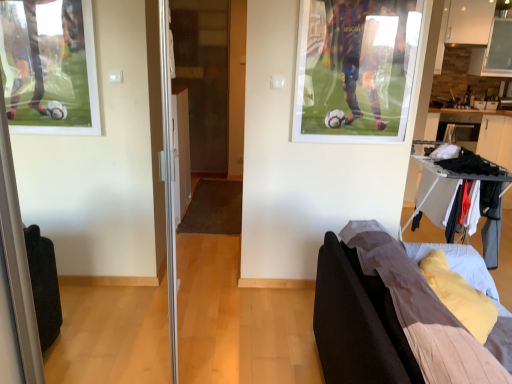
Question: From the image's perspective, is transparent glass screen door at center above or below brown fabric couch at lower right?

Choices:
 (A) above
 (B) below

Answer: (A)

Question: Considering the relative positions of transparent glass screen door at center and brown fabric couch at lower right in the image provided, is transparent glass screen door at center to the left or to the right of brown fabric couch at lower right?

Choices:
 (A) right
 (B) left

Answer: (B)

Question: Which is correct: transparent glass screen door at center is inside brown fabric couch at lower right, or outside of it?

Choices:
 (A) inside
 (B) outside

Answer: (B)

Question: From the image's perspective, is brown fabric couch at lower right located above or below transparent glass screen door at center?

Choices:
 (A) below
 (B) above

Answer: (A)

Question: Is brown fabric couch at lower right taller or shorter than transparent glass screen door at center?

Choices:
 (A) tall
 (B) short

Answer: (B)

Question: Based on their positions, is brown fabric couch at lower right located to the left or right of transparent glass screen door at center?

Choices:
 (A) right
 (B) left

Answer: (A)

Question: Is point (459, 370) closer or farther from the camera than point (204, 99)?

Choices:
 (A) closer
 (B) farther

Answer: (A)